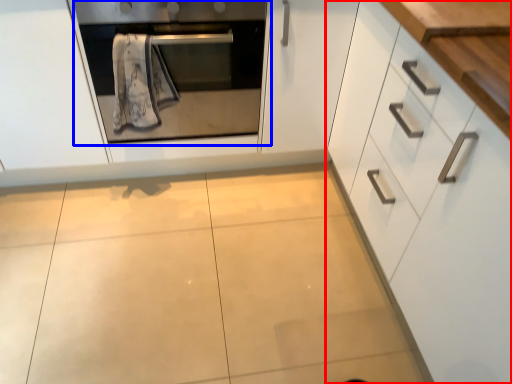
Question: Among these objects, which one is farthest to the camera, cabinetry (highlighted by a red box) or oven (highlighted by a blue box)?

Choices:
 (A) cabinetry
 (B) oven

Answer: (B)